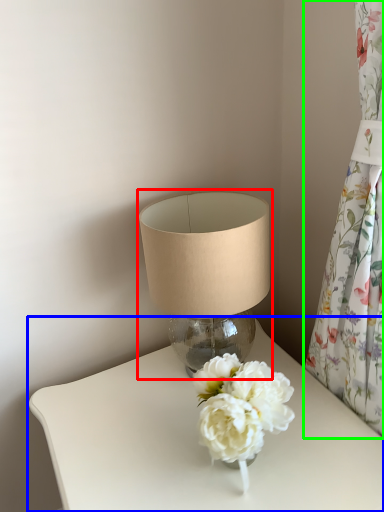
Question: Estimate the real-world distances between objects in this image. Which object is farther from lamp (highlighted by a red box), table (highlighted by a blue box) or curtain (highlighted by a green box)?

Choices:
 (A) table
 (B) curtain

Answer: (B)